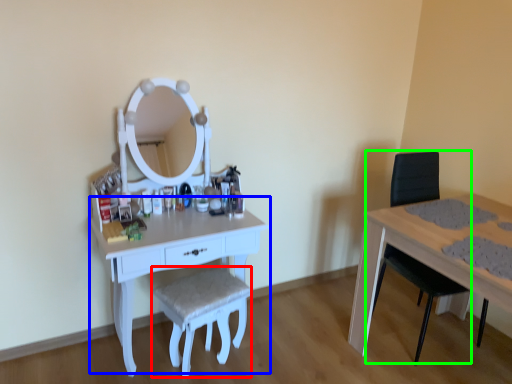
Question: Considering the real-world distances, which object is farthest from stool (highlighted by a red box)? table (highlighted by a blue box) or swivel chair (highlighted by a green box)?

Choices:
 (A) table
 (B) swivel chair

Answer: (B)